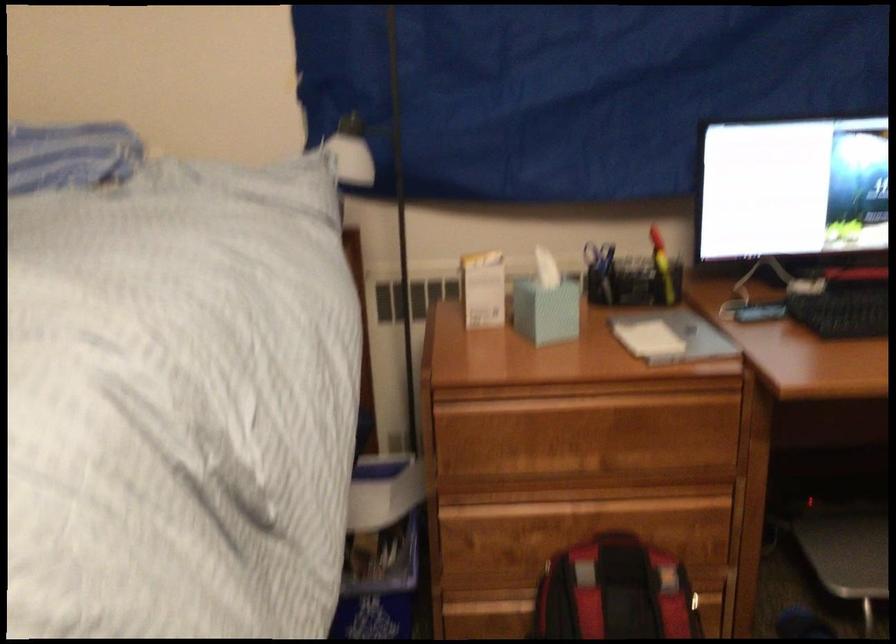
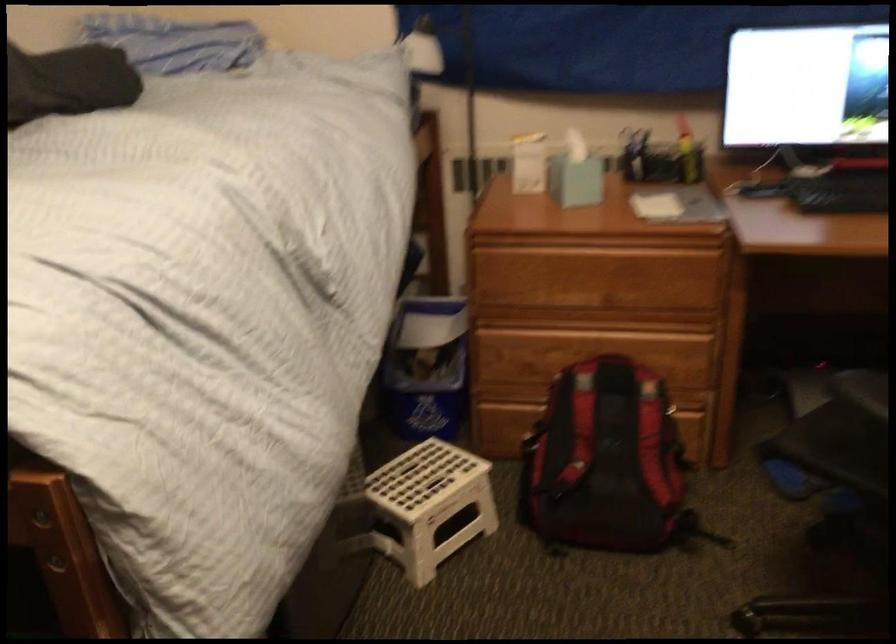
Where in the second image is the point corresponding to pixel 631 278 from the first image?

(660, 158)